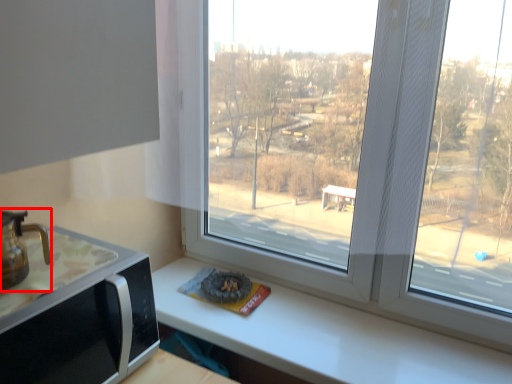
Question: Where is coffeepot (annotated by the red box) located in relation to appliance in the image?

Choices:
 (A) left
 (B) right

Answer: (A)